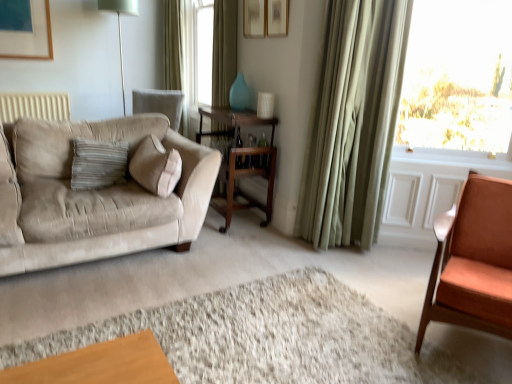
Where is `free space above smooth orange chair at right (from a real-world perspective)`? The image size is (512, 384). free space above smooth orange chair at right (from a real-world perspective) is located at coordinates (266, 332).